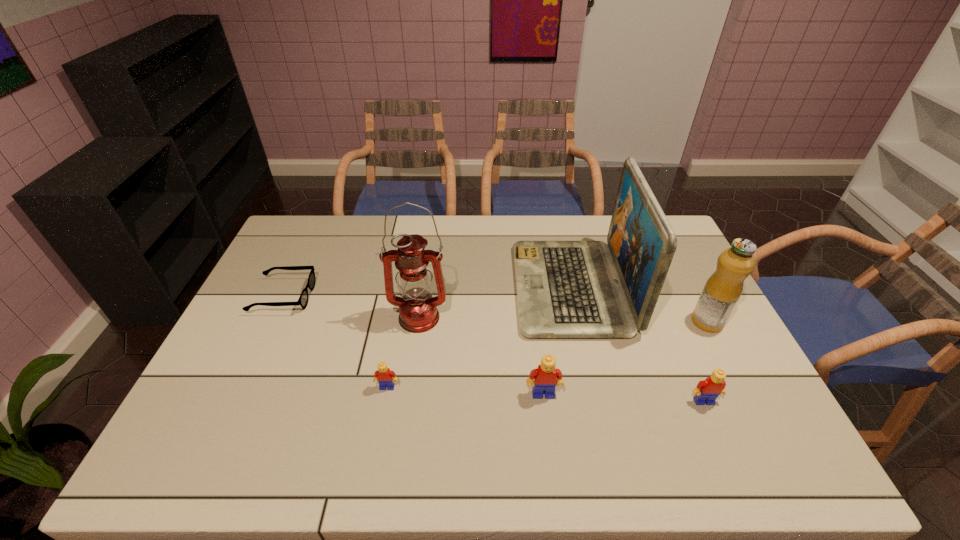
I want to click on the fifth shortest object, so click(724, 287).

Image resolution: width=960 pixels, height=540 pixels. In order to click on the rightmost object in this screenshot , I will do `click(724, 287)`.

Locate an element on the screen. The width and height of the screenshot is (960, 540). free space located on the face of the leftmost Lego is located at coordinates (381, 423).

Image resolution: width=960 pixels, height=540 pixels. Find the location of `free space located on the face of the second Lego from left to right`. free space located on the face of the second Lego from left to right is located at coordinates (547, 426).

The image size is (960, 540). In order to click on vacant space situated on the screen of the laptop computer in this screenshot , I will do `click(451, 288)`.

Locate an element on the screen. The width and height of the screenshot is (960, 540). vacant space located on the screen of the laptop computer is located at coordinates (482, 288).

In order to click on free space located 0.290m on the screen of the laptop computer in this screenshot , I will do [426, 288].

The image size is (960, 540). I want to click on free location located 0.170m on the right of the oil lamp, so click(504, 318).

Where is `vacant area situated on the arms of the spectacles`? vacant area situated on the arms of the spectacles is located at coordinates (339, 296).

Find the location of a particular element. free space located 0.090m on the front label of the third tallest object is located at coordinates click(661, 322).